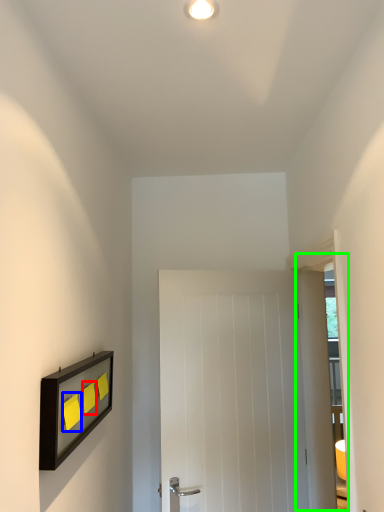
Question: Which is farther away from light switch (highlighted by a red box)? light switch (highlighted by a blue box) or glass door (highlighted by a green box)?

Choices:
 (A) light switch
 (B) glass door

Answer: (B)